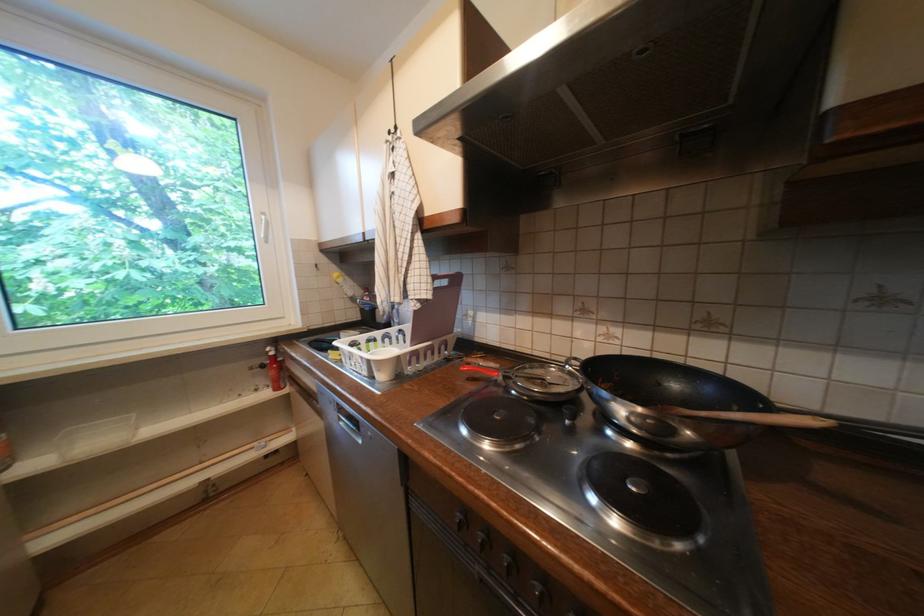
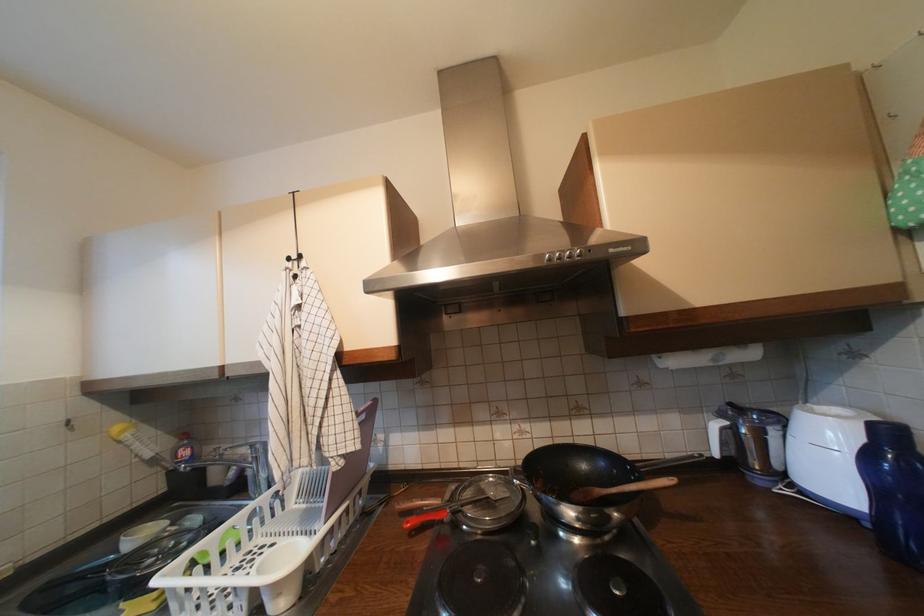
In the second image, find the point that corresponds to point 373,293 in the first image.

(189, 440)